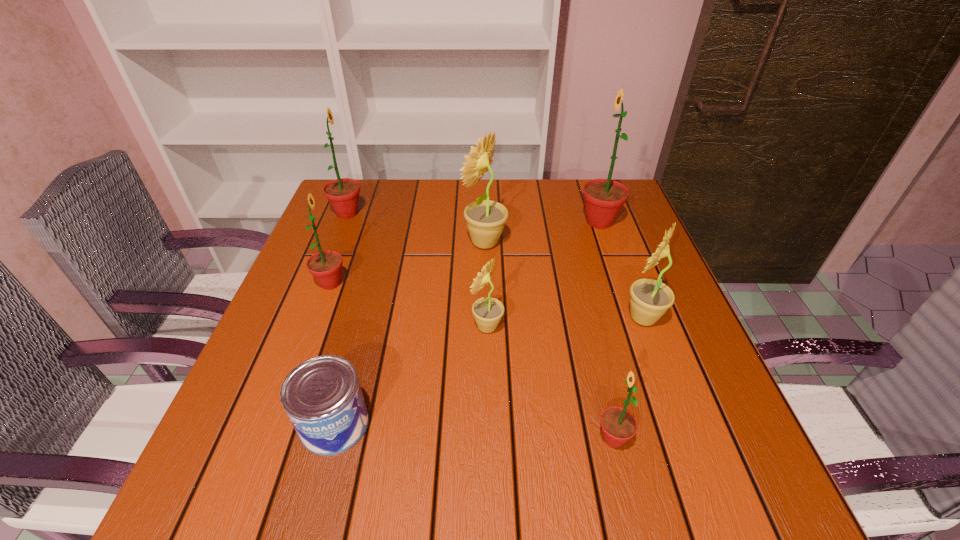
This screenshot has height=540, width=960. Find the location of `free area in between the third biggest green sunflower and the biggest yellow sunflower`. free area in between the third biggest green sunflower and the biggest yellow sunflower is located at coordinates (408, 263).

The image size is (960, 540). In order to click on vacant space that is in between the biggest yellow sunflower and the rightmost yellow sunflower in this screenshot , I will do `click(564, 280)`.

The image size is (960, 540). In order to click on empty space that is in between the blue can and the second smallest yellow sunflower in this screenshot , I will do [489, 371].

The width and height of the screenshot is (960, 540). In order to click on vacant area that lies between the farthest yellow sunflower and the smallest green sunflower in this screenshot , I will do `click(549, 340)`.

Locate an element on the screen. The height and width of the screenshot is (540, 960). free space that is in between the tallest sunflower and the can is located at coordinates tap(467, 323).

Where is `vacant space in between the farthest yellow sunflower and the tallest object`? vacant space in between the farthest yellow sunflower and the tallest object is located at coordinates (542, 232).

The width and height of the screenshot is (960, 540). Identify the location of object that can be found as the second closest to the second biggest green sunflower. (486, 219).

Locate an element on the screen. This screenshot has height=540, width=960. the closest object to the tallest sunflower is located at coordinates (486, 219).

Locate an element on the screen. This screenshot has width=960, height=540. sunflower that is the sixth closest to the second smallest green sunflower is located at coordinates pos(650,299).

Identify which sunflower is the fifth closest to the biggest yellow sunflower. Please provide its 2D coordinates. Your answer should be formatted as a tuple, i.e. [(x, y)], where the tuple contains the x and y coordinates of a point satisfying the conditions above.

[(342, 193)]